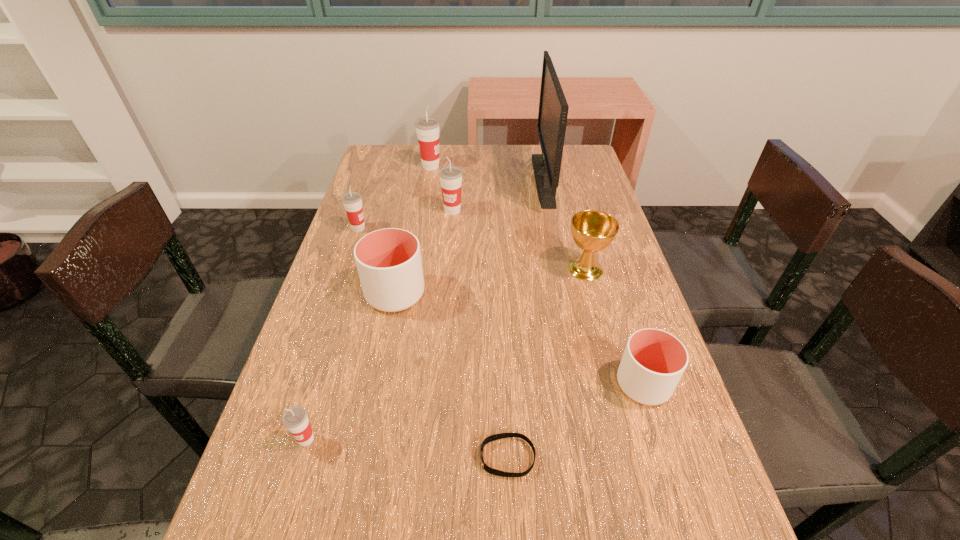
Image resolution: width=960 pixels, height=540 pixels. What are the coordinates of `vacant region located on the side of the third tallest object with the logo` in the screenshot? It's located at (449, 247).

Identify the location of vacant position located on the left of the gold chalice. Image resolution: width=960 pixels, height=540 pixels. (486, 269).

Where is `free space located on the side of the third biggest red cup with the logo`? free space located on the side of the third biggest red cup with the logo is located at coordinates (424, 228).

You are a GUI agent. You are given a task and a screenshot of the screen. Output one action in this format:
    pyautogui.click(x=<x>, y=<y>)
    Task: Click on the vacant space located on the right of the bigger white cup
    Image resolution: width=960 pixels, height=540 pixels.
    Given the screenshot: What is the action you would take?
    pyautogui.click(x=545, y=294)

The width and height of the screenshot is (960, 540). What are the coordinates of `vacant space located 0.390m on the back of the second nearest cup` in the screenshot? It's located at (599, 244).

Where is `blank area located 0.090m on the side of the smallest red cup with the logo`? blank area located 0.090m on the side of the smallest red cup with the logo is located at coordinates (287, 504).

I want to click on vacant space located on the display of the shortest object, so click(353, 457).

Image resolution: width=960 pixels, height=540 pixels. What are the coordinates of `vacant space located on the display of the shortest object` in the screenshot? It's located at (394, 457).

Where is `vacant position located on the display of the shortest object`? vacant position located on the display of the shortest object is located at coordinates (382, 457).

Locate an element on the screen. This screenshot has height=540, width=960. monitor at the far edge is located at coordinates (553, 108).